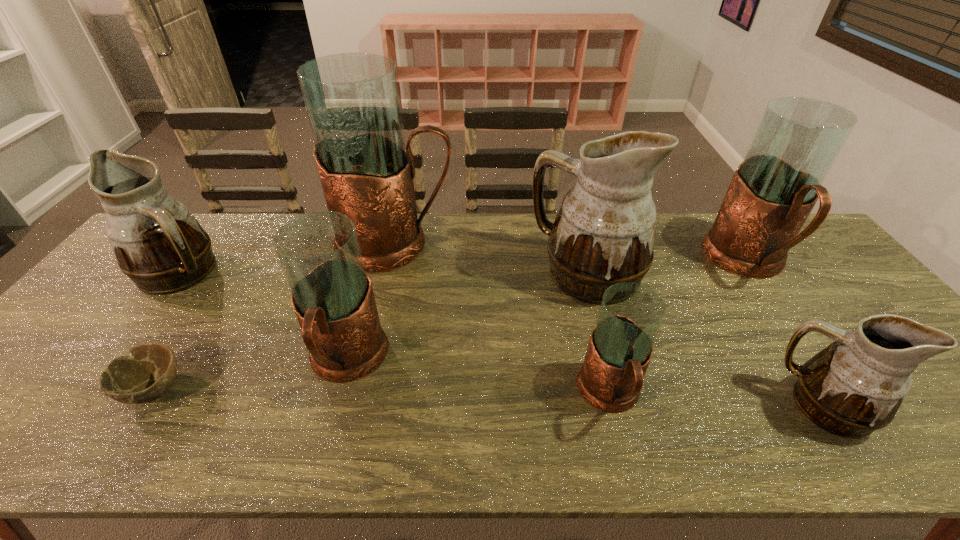
Find the location of a particular element. This screenshot has width=960, height=540. gray pitcher that is the nearest to the rightmost gray pitcher is located at coordinates (620, 347).

Locate an element on the screen. the closest gray pitcher to the shortest object is located at coordinates (319, 252).

I want to click on the closest brown pitcher relative to the smallest gray pitcher, so click(604, 233).

Choose which brown pitcher is the third nearest neighbor to the smallest gray pitcher. Please provide its 2D coordinates. Your answer should be formatted as a tuple, i.e. [(x, y)], where the tuple contains the x and y coordinates of a point satisfying the conditions above.

[(158, 243)]

This screenshot has height=540, width=960. I want to click on free point that satisfies the following two spatial constraints: 1. from the spout of the leftmost brown pitcher; 2. on the back side of the shortest object, so click(96, 388).